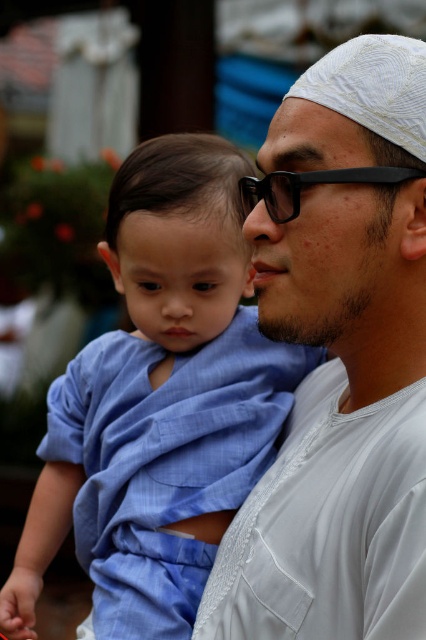
Question: Can you confirm if blue cotton cloth at center is thinner than black matte glasses at center?

Choices:
 (A) no
 (B) yes

Answer: (A)

Question: Which of the following is the farthest from the observer?

Choices:
 (A) white textured shirt at center
 (B) blue cotton cloth at center

Answer: (B)

Question: Is blue cotton cloth at center closer to camera compared to black matte glasses at center?

Choices:
 (A) yes
 (B) no

Answer: (B)

Question: Which point is closer to the camera?

Choices:
 (A) (305, 243)
 (B) (241, 188)

Answer: (A)

Question: Which object appears farthest from the camera in this image?

Choices:
 (A) white textured shirt at center
 (B) black matte glasses at center

Answer: (B)

Question: Does white textured shirt at center come behind blue cotton cloth at center?

Choices:
 (A) yes
 (B) no

Answer: (B)